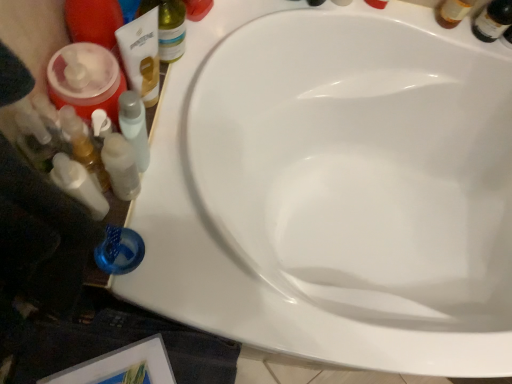
Find the location of a particular element. Image resolution: width=512 pixels, height=384 pixels. translucent glass beer bottle at upper right is located at coordinates (493, 20).

You are a GUI agent. You are given a task and a screenshot of the screen. Output one action in this format:
    pyautogui.click(x=<x>, y=<y>)
    Task: Click on the white plastic bottles at left
    This screenshot has width=512, height=384.
    Given the screenshot: What is the action you would take?
    pyautogui.click(x=78, y=185)

Is translucent plastic bottle at upper left turned away from white plastic bottles at left?

That's not correct — translucent plastic bottle at upper left is not looking away from white plastic bottles at left.

Who is bigger, translucent plastic bottle at upper left or white plastic bottles at left?

With larger size is translucent plastic bottle at upper left.

In terms of width, does translucent plastic bottle at upper left look wider or thinner when compared to white plastic bottles at left?

In the image, translucent plastic bottle at upper left appears to be wider than white plastic bottles at left.

Is translucent plastic bottle at upper left positioned far away from white plastic bottles at left?

No, translucent plastic bottle at upper left is not far from white plastic bottles at left.

This screenshot has height=384, width=512. Identify the location of bottle below the translucent glass beer bottle at upper right (from the image's perspective). (168, 27).

Is translucent glass beer bottle at upper right bigger or smaller than translucent plastic bottle at upper left?

In the image, translucent glass beer bottle at upper right appears to be smaller than translucent plastic bottle at upper left.

Is translucent glass beer bottle at upper right facing towards translucent plastic bottle at upper left?

No, translucent glass beer bottle at upper right is not turned towards translucent plastic bottle at upper left.

From a real-world perspective, is translucent glass beer bottle at upper right positioned above or below translucent plastic bottle at upper left?

Clearly, from a real-world perspective, translucent glass beer bottle at upper right is below translucent plastic bottle at upper left.

How different are the orientations of translucent plastic bottle at upper left and translucent glass beer bottle at upper right in degrees?

The angle between the facing direction of translucent plastic bottle at upper left and the facing direction of translucent glass beer bottle at upper right is 95.4 degrees.

From the image's perspective, relative to translucent glass beer bottle at upper right, is translucent plastic bottle at upper left above or below?

From the image's perspective, translucent plastic bottle at upper left appears below translucent glass beer bottle at upper right.

Considering the sizes of translucent plastic bottle at upper left and translucent glass beer bottle at upper right in the image, is translucent plastic bottle at upper left wider or thinner than translucent glass beer bottle at upper right?

In the image, translucent plastic bottle at upper left appears to be wider than translucent glass beer bottle at upper right.

Is white plastic bottles at left placed right next to translucent plastic bottle at upper left?

There is a gap between white plastic bottles at left and translucent plastic bottle at upper left.

Measure the distance between white plastic bottles at left and translucent plastic bottle at upper left.

white plastic bottles at left is 30.87 centimeters from translucent plastic bottle at upper left.

Between white plastic bottles at left and translucent plastic bottle at upper left, which one has less height?

white plastic bottles at left is shorter.

Which of these two, white plastic bottles at left or translucent plastic bottle at upper left, is wider?

Wider between the two is translucent plastic bottle at upper left.

From a real-world perspective, is white plastic bottles at left positioned over translucent glass beer bottle at upper right based on gravity?

Correct, in the physical world, white plastic bottles at left is higher than translucent glass beer bottle at upper right.

Locate an element on the screen. This screenshot has width=512, height=384. beer bottle on the right of white plastic bottles at left is located at coordinates (493, 20).

Is white plastic bottles at left completely or partially outside of translucent glass beer bottle at upper right?

That's correct, white plastic bottles at left is outside of translucent glass beer bottle at upper right.

Based on the photo, which is closer to the camera, (75,186) or (489,16)?

Clearly, point (75,186) is closer to the camera than point (489,16).

From a real-world perspective, relative to white plastic bottles at left, is translucent glass beer bottle at upper right vertically above or below?

translucent glass beer bottle at upper right is below white plastic bottles at left.

Between translucent glass beer bottle at upper right and white plastic bottles at left, which one has smaller width?

Thinner between the two is translucent glass beer bottle at upper right.

Considering the points (499, 13) and (104, 213), which point is behind, point (499, 13) or point (104, 213)?

The point (499, 13) is behind.

Which is more to the left, translucent glass beer bottle at upper right or white plastic bottles at left?

white plastic bottles at left.

Find the location of a particular element. This screenshot has height=384, width=512. toiletry below the translucent plastic bottle at upper left (from the image's perspective) is located at coordinates (78, 185).

I want to click on beer bottle above the translucent plastic bottle at upper left (from the image's perspective), so click(493, 20).

Considering their positions, is translucent glass beer bottle at upper right positioned closer to white plastic bottles at left than translucent plastic bottle at upper left?

translucent plastic bottle at upper left.

Considering their positions, is white plastic bottles at left positioned further to translucent plastic bottle at upper left than translucent glass beer bottle at upper right?

translucent glass beer bottle at upper right is positioned further to the anchor translucent plastic bottle at upper left.

Looking at the image, which one is located further to translucent glass beer bottle at upper right, white plastic bottles at left or translucent plastic bottle at upper left?

white plastic bottles at left is further to translucent glass beer bottle at upper right.

When comparing their distances from white plastic bottles at left, does translucent plastic bottle at upper left or translucent glass beer bottle at upper right seem further?

translucent glass beer bottle at upper right.

Estimate the real-world distances between objects in this image. Which object is closer to translucent plastic bottle at upper left, translucent glass beer bottle at upper right or white plastic bottles at left?

white plastic bottles at left is closer to translucent plastic bottle at upper left.

From the image, which object appears to be nearer to translucent glass beer bottle at upper right, translucent plastic bottle at upper left or white plastic bottles at left?

translucent plastic bottle at upper left.

The height and width of the screenshot is (384, 512). Identify the location of bottle between white plastic bottles at left and translucent glass beer bottle at upper right. (168, 27).